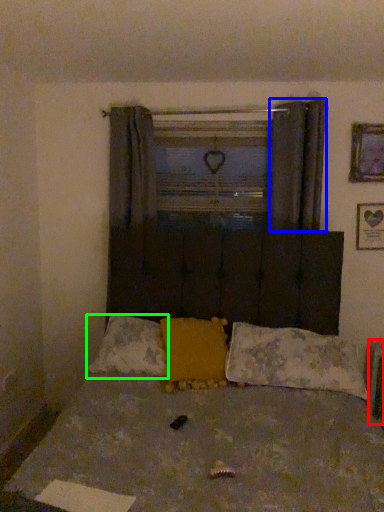
Question: Based on their relative distances, which object is nearer to radiator (highlighted by a red box)? Choose from curtain (highlighted by a blue box) and pillow (highlighted by a green box).

Choices:
 (A) curtain
 (B) pillow

Answer: (A)